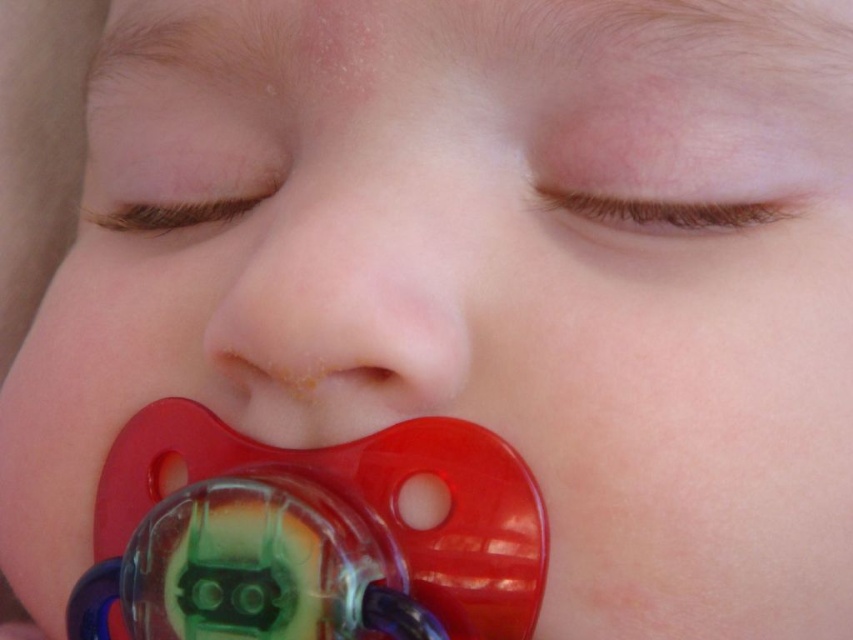
Question: Can you confirm if translucent plastic pacifier at lower center is positioned to the left of matte plastic pacifier at center?

Choices:
 (A) no
 (B) yes

Answer: (B)

Question: Does translucent plastic pacifier at lower center come behind matte plastic pacifier at center?

Choices:
 (A) yes
 (B) no

Answer: (A)

Question: Estimate the real-world distances between objects in this image. Which object is farther from the smooth skin nose at center?

Choices:
 (A) matte plastic pacifier at center
 (B) translucent plastic pacifier at lower center

Answer: (B)

Question: Is smooth skin nose at center behind translucent plastic pacifier at lower center?

Choices:
 (A) no
 (B) yes

Answer: (A)

Question: Which is farther from the smooth skin nose at center?

Choices:
 (A) matte plastic pacifier at center
 (B) translucent plastic pacifier at lower center

Answer: (B)

Question: Among these points, which one is nearest to the camera?

Choices:
 (A) (483, 518)
 (B) (308, 378)
 (C) (251, 291)

Answer: (A)